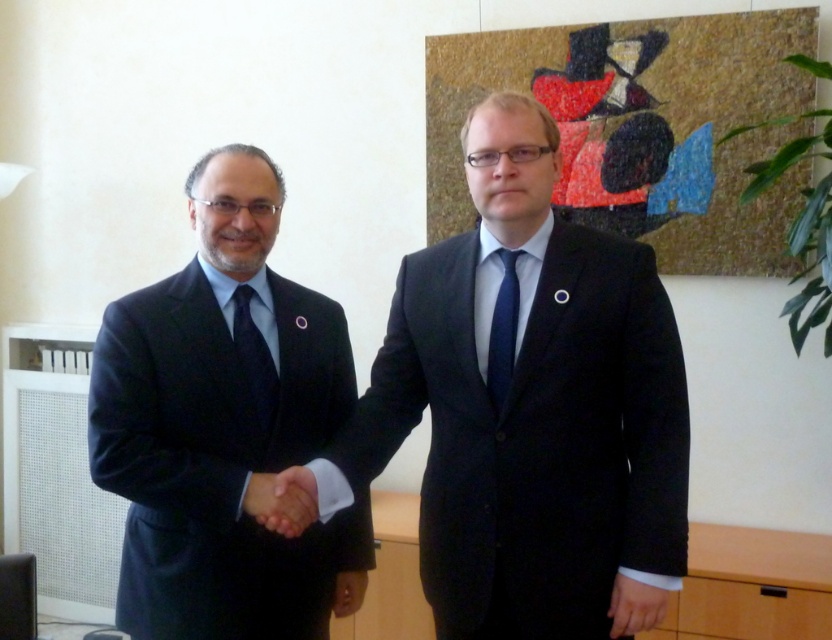
Can you confirm if matte black suit at left is bigger than matte black hand at lower center?

Yes.

Is point (296, 353) closer to viewer compared to point (360, 589)?

Yes, it is.

You are a GUI agent. You are given a task and a screenshot of the screen. Output one action in this format:
    pyautogui.click(x=<x>, y=<y>)
    Task: Click on the matte black suit at left
    The height and width of the screenshot is (640, 832).
    Given the screenshot: What is the action you would take?
    pyautogui.click(x=221, y=424)

From the picture: Which is below, black matte hand at center or matte black hand at lower right?

matte black hand at lower right

I want to click on black matte hand at center, so click(x=281, y=500).

Identify the location of black matte hand at center. (281, 500).

How far apart are matte black suit at left and matte black hand at lower right?

matte black suit at left is 31.38 inches from matte black hand at lower right.

Does matte black suit at left have a lesser width compared to matte black hand at lower right?

No, matte black suit at left is not thinner than matte black hand at lower right.

Does point (157, 348) come behind point (652, 595)?

Yes.

At what (x,y) coordinates should I click in order to perform the action: click on matte black suit at left. Please return your answer as a coordinate pair (x, y). Looking at the image, I should click on (221, 424).